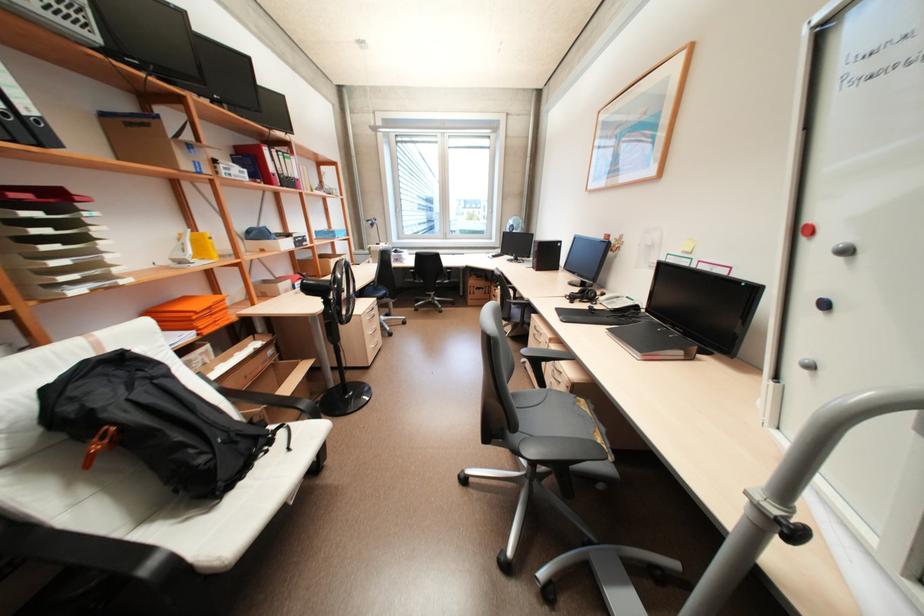
Where would you lift the telephone handset? Please return your answer as a coordinate pair (x, y).

(610, 296)